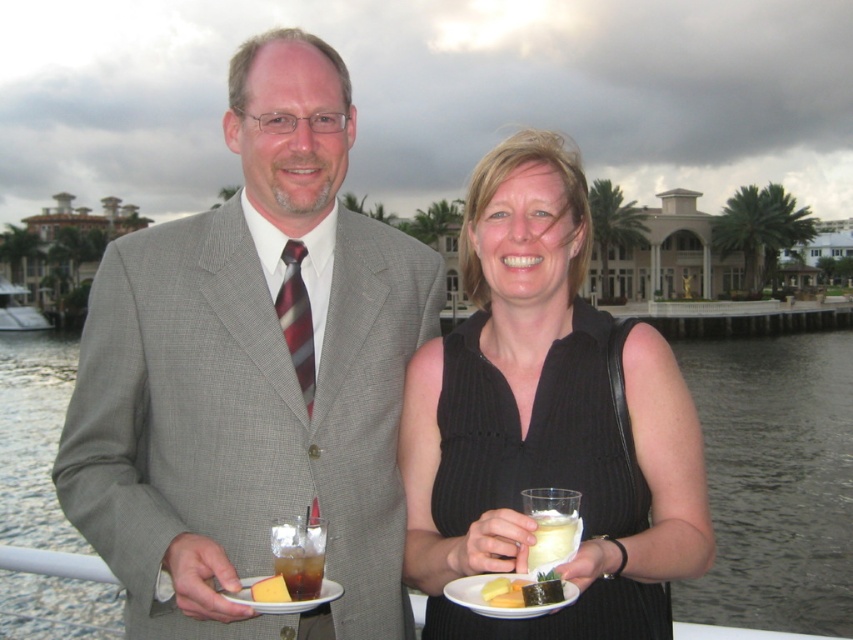
Question: Estimate the real-world distances between objects in this image. Which object is closer to the gray textured suit at center?

Choices:
 (A) clear liquid at center
 (B) yellow matte sushi at lower center
 (C) white opaque cup at center
 (D) white ceramic plate at lower center

Answer: (D)

Question: In this image, where is clear liquid at center located relative to dark brown liquid at lower left?

Choices:
 (A) right
 (B) left

Answer: (A)

Question: Which object appears farthest from the camera in this image?

Choices:
 (A) clear liquid at center
 (B) black ribbed dress at center
 (C) yellow matte sushi at lower center
 (D) dark brown liquid at lower left

Answer: (A)

Question: Is gray textured suit at center above white opaque cup at center?

Choices:
 (A) yes
 (B) no

Answer: (A)

Question: Which of these objects is positioned farthest from the white ceramic plate at lower center?

Choices:
 (A) yellow cheese at lower center
 (B) gray textured suit at center
 (C) dark brown liquid at lower left

Answer: (B)

Question: Is white matte plate at lower center above dark brown liquid at lower left?

Choices:
 (A) yes
 (B) no

Answer: (B)